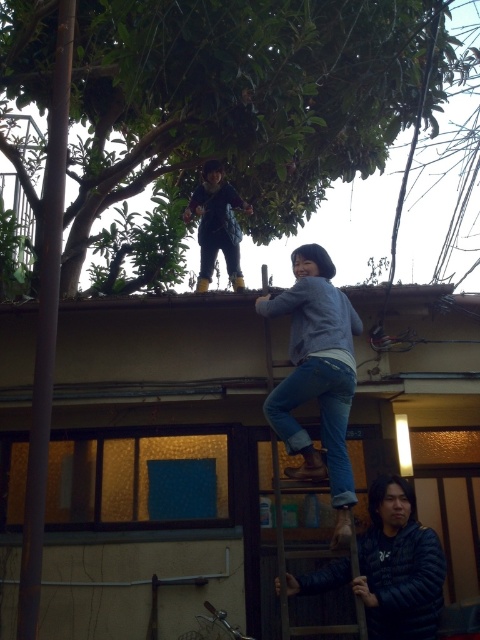
Between green leafy tree at upper center and matte black jacket at upper center, which one has more height?

matte black jacket at upper center is taller.

Identify the location of green leafy tree at upper center. (239, 99).

The image size is (480, 640). I want to click on green leafy tree at upper center, so click(239, 99).

Is green leafy tree at upper center to the left of wooden at upper center from the viewer's perspective?

Answer: Indeed, green leafy tree at upper center is positioned on the left side of wooden at upper center.

Consider the image. Can you confirm if green leafy tree at upper center is thinner than wooden at upper center?

No.

The height and width of the screenshot is (640, 480). What do you see at coordinates (239, 99) in the screenshot? I see `green leafy tree at upper center` at bounding box center [239, 99].

Find the location of a particular element. The image size is (480, 640). green leafy tree at upper center is located at coordinates (239, 99).

Measure the distance from dark blue padded jacket at lower right to matte black jacket at upper center.

They are 11.84 feet apart.

Does dark blue padded jacket at lower right have a greater height compared to matte black jacket at upper center?

No.

Who is more distant from viewer, (364, 561) or (200, 264)?

The point (200, 264) is more distant.

The image size is (480, 640). Find the location of `dark blue padded jacket at lower right`. dark blue padded jacket at lower right is located at coordinates (398, 566).